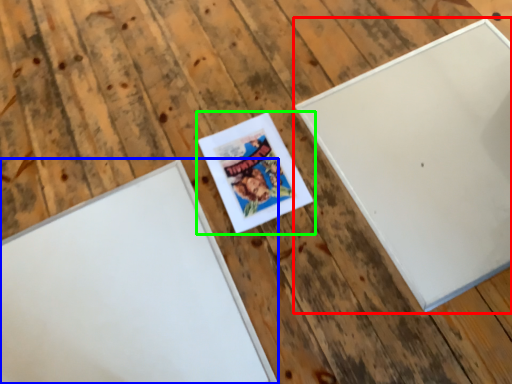
Question: Which object is positioned closest to picture frame (highlighted by a red box)? Select from picture frame (highlighted by a blue box) and picture frame (highlighted by a green box).

Choices:
 (A) picture frame
 (B) picture frame

Answer: (B)